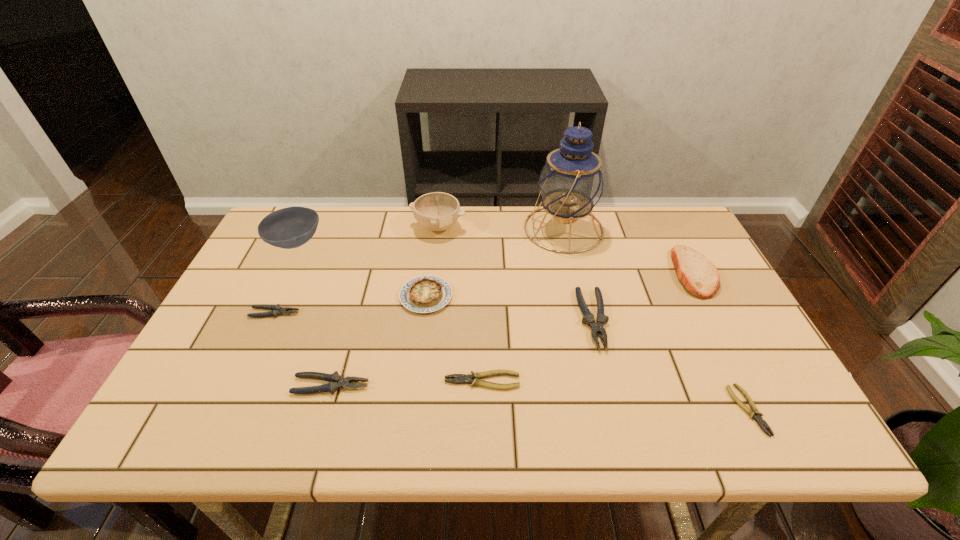
Locate an element on the screen. the tallest object is located at coordinates point(571,183).

The height and width of the screenshot is (540, 960). Find the location of `lantern`. lantern is located at coordinates (571, 183).

Where is `the right bowl`? the right bowl is located at coordinates (437, 211).

Find the location of a particular element. the left bowl is located at coordinates (291, 227).

Where is `pita bread`? This screenshot has height=540, width=960. pita bread is located at coordinates (700, 277).

Where is `quiche`? This screenshot has width=960, height=540. quiche is located at coordinates (424, 294).

At what (x,y) coordinates should I click in order to perform the action: click on the tallest pliers. Please return your answer as a coordinate pair (x, y). This screenshot has width=960, height=540. Looking at the image, I should click on (596, 327).

Where is `the rightmost gray pliers`? This screenshot has height=540, width=960. the rightmost gray pliers is located at coordinates (596, 327).

The height and width of the screenshot is (540, 960). What are the coordinates of `the fourth shortest object` in the screenshot? It's located at (336, 382).

Locate an element on the screen. The image size is (960, 540). the fourth pliers from right to left is located at coordinates (336, 382).